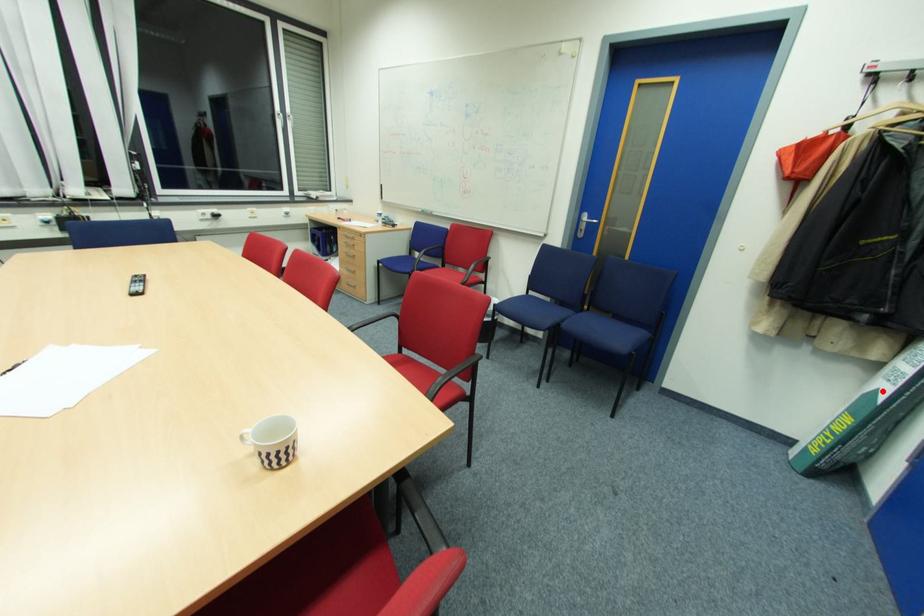
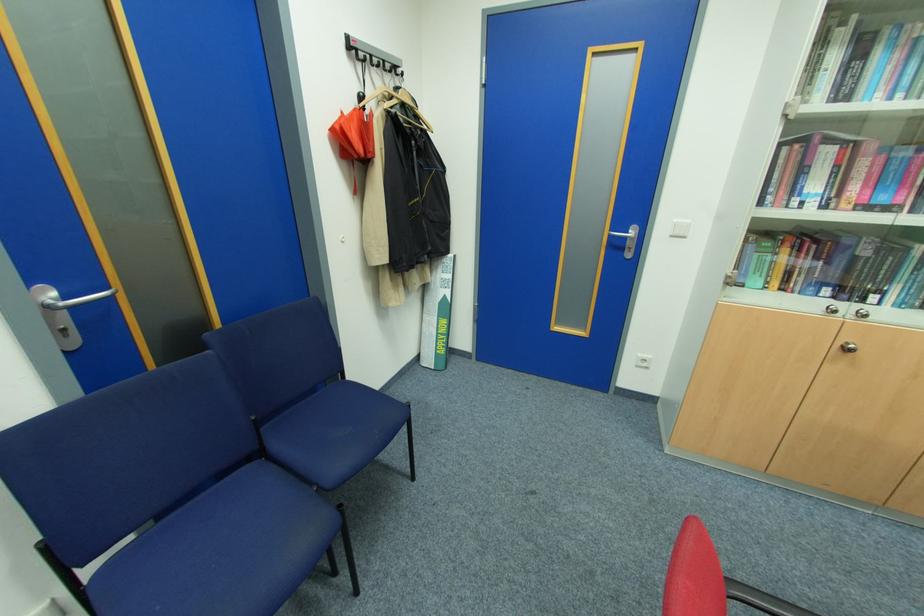
Question: I am providing you with two images of the same scene from different viewpoints. In image1, a red point is highlighted. Considering the same 3D point in image2, which of the following is correct?

Choices:
 (A) It is closer
 (B) It is farther

Answer: (A)